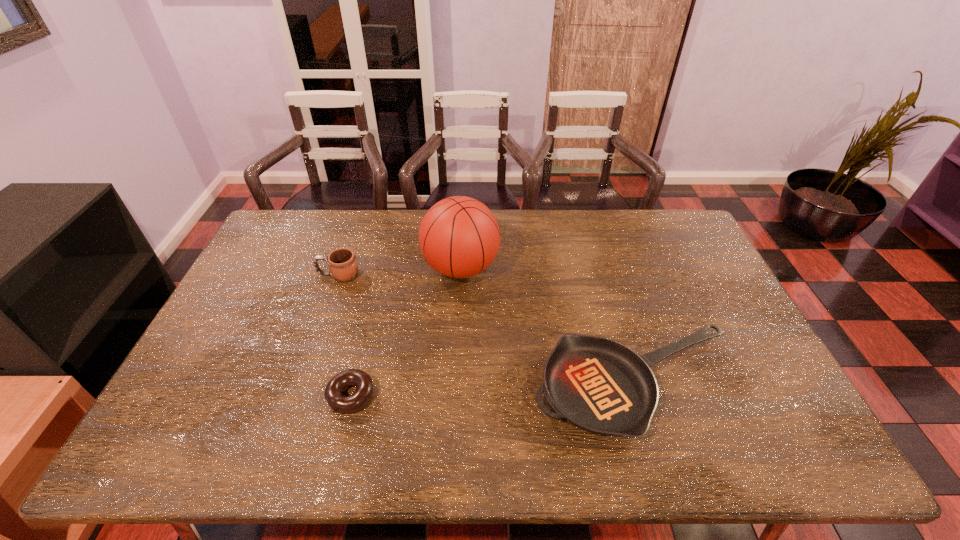
This screenshot has width=960, height=540. What are the coordinates of `vacant space at the far left corner` in the screenshot? It's located at (275, 246).

You are a GUI agent. You are given a task and a screenshot of the screen. Output one action in this format:
    pyautogui.click(x=<x>, y=<y>)
    Task: Click on the free spot at the near right corner of the desktop
    The image size is (960, 540).
    Given the screenshot: What is the action you would take?
    pyautogui.click(x=781, y=450)

Find the location of a particular element. This screenshot has width=960, height=540. vacant region between the tallest object and the doughnut is located at coordinates (406, 332).

I want to click on free space that is in between the frying pan and the second object from left to right, so point(493,390).

The image size is (960, 540). What are the coordinates of `vacant area that lies between the leftmost object and the second object from right to left` in the screenshot? It's located at (399, 272).

At what (x,y) coordinates should I click in order to perform the action: click on free space between the third shortest object and the basketball. Please return your answer as a coordinate pair (x, y). Looking at the image, I should click on (399, 272).

Find the location of a particular element. The height and width of the screenshot is (540, 960). vacant area between the second object from right to left and the mug is located at coordinates (399, 272).

At what (x,y) coordinates should I click in order to perform the action: click on free space that is in between the third object from right to left and the rightmost object. Please return your answer as a coordinate pair (x, y). This screenshot has width=960, height=540. Looking at the image, I should click on (493, 390).

Find the location of a particular element. empty location between the rightmost object and the tallest object is located at coordinates (548, 327).

This screenshot has width=960, height=540. Find the location of `empty space that is in between the frying pan and the tallest object`. empty space that is in between the frying pan and the tallest object is located at coordinates (548, 327).